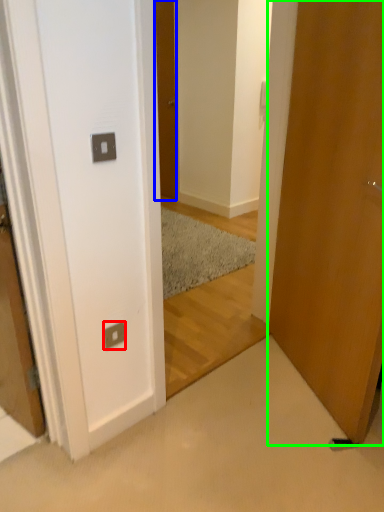
Question: Which object is positioned farthest from electric outlet (highlighted by a red box)? Select from door (highlighted by a blue box) and door (highlighted by a green box).

Choices:
 (A) door
 (B) door

Answer: (A)